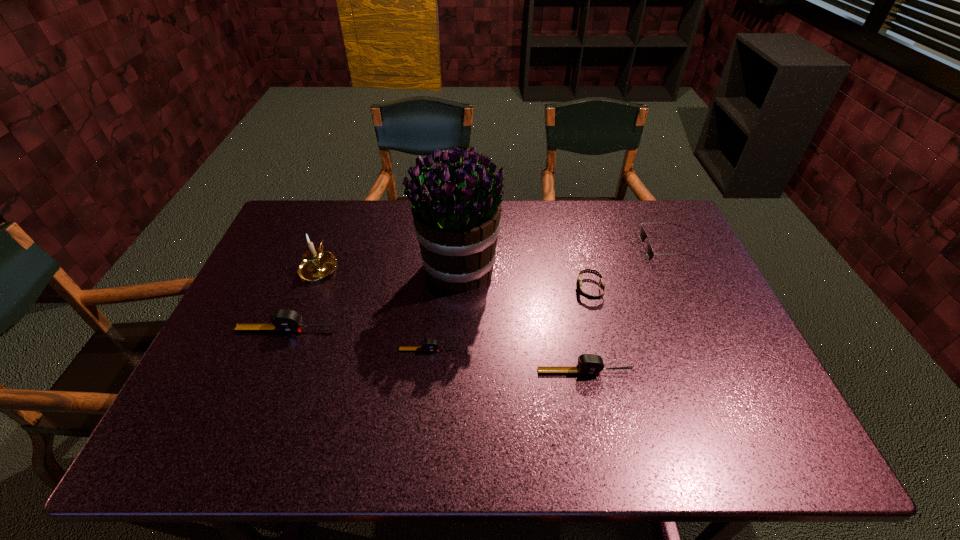
Where is `free location at the near edge of the desktop`? This screenshot has width=960, height=540. free location at the near edge of the desktop is located at coordinates (608, 410).

Identify the location of vacant space at the left edge. This screenshot has height=540, width=960. (275, 341).

I want to click on free spot at the far left corner of the desktop, so click(x=299, y=223).

Where is `free space at the near left corner of the desktop`? free space at the near left corner of the desktop is located at coordinates (200, 387).

This screenshot has height=540, width=960. Identify the location of vacant region at the far right corner of the desktop. (632, 207).

Locate an element on the screen. empty space between the candle holder and the nearest tape measure is located at coordinates (452, 319).

Identify the location of empty space that is in between the second nearest object and the fourth shortest object. The width and height of the screenshot is (960, 540). (507, 361).

The height and width of the screenshot is (540, 960). I want to click on free spot between the second shortest tape measure and the watch, so click(587, 331).

Identify the location of unoccupied position between the watch and the leftmost tape measure. (438, 310).

The image size is (960, 540). I want to click on empty space between the farthest tape measure and the watch, so click(x=438, y=310).